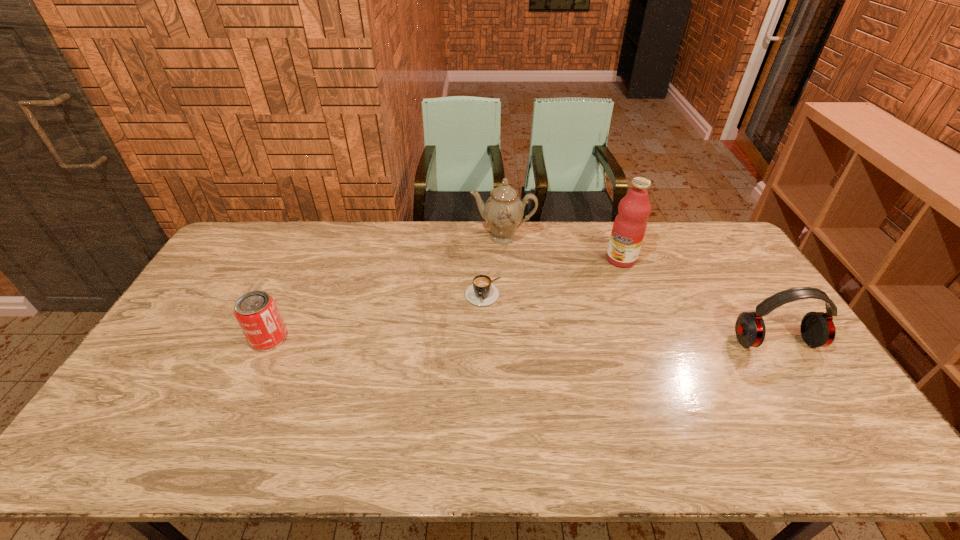
The height and width of the screenshot is (540, 960). I want to click on free space on the desktop that is between the can and the earphone and is positioned with the handle on the side of the third nearest object, so click(x=474, y=340).

At what (x,y) coordinates should I click in order to perform the action: click on vacant space on the desktop that is between the can and the third tallest object and is positioned on the label of the second object from right to left. Please return your answer as a coordinate pair (x, y). Looking at the image, I should click on (535, 340).

Where is `vacant space on the desktop that is between the fourth tallest object and the third tallest object and is positioned on the spout of the chinaware`? The height and width of the screenshot is (540, 960). vacant space on the desktop that is between the fourth tallest object and the third tallest object and is positioned on the spout of the chinaware is located at coordinates (482, 340).